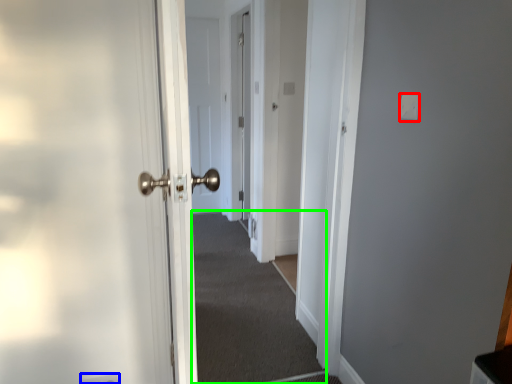
Question: Which object is the closest to the light switch (highlighted by a red box)? Choose among these: electric outlet (highlighted by a blue box) or corridor (highlighted by a green box).

Choices:
 (A) electric outlet
 (B) corridor

Answer: (A)